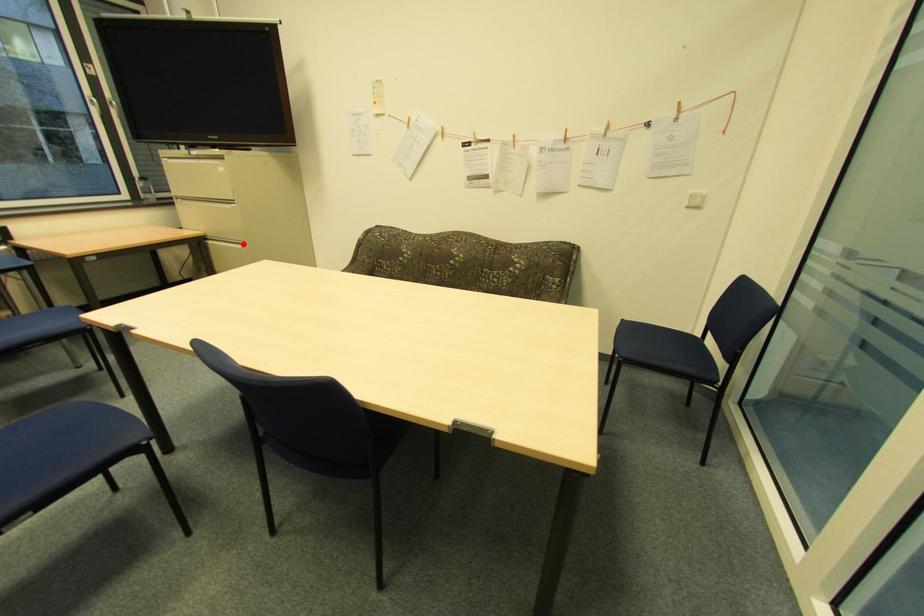
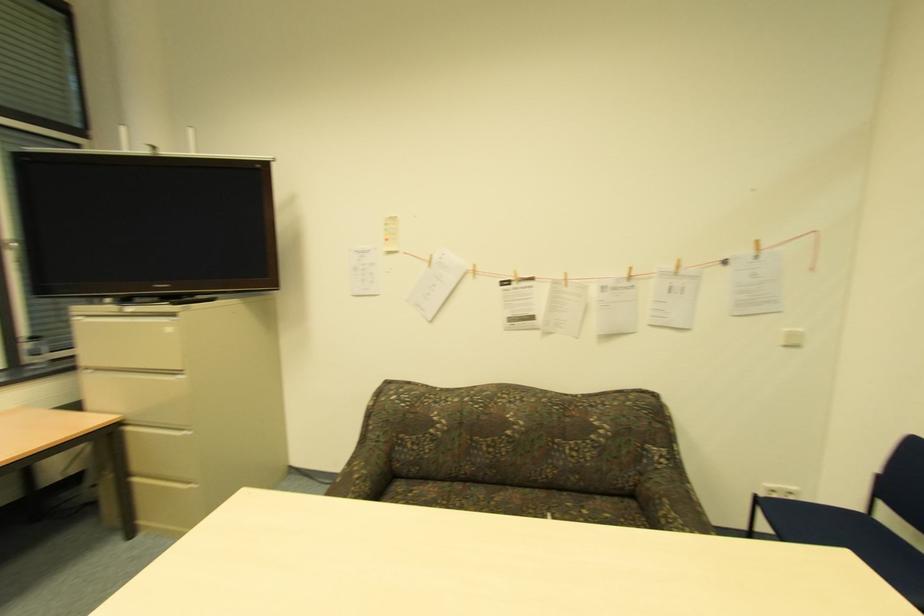
Where in the second image is the point corresponding to the highlighted location from the first image?

(187, 429)